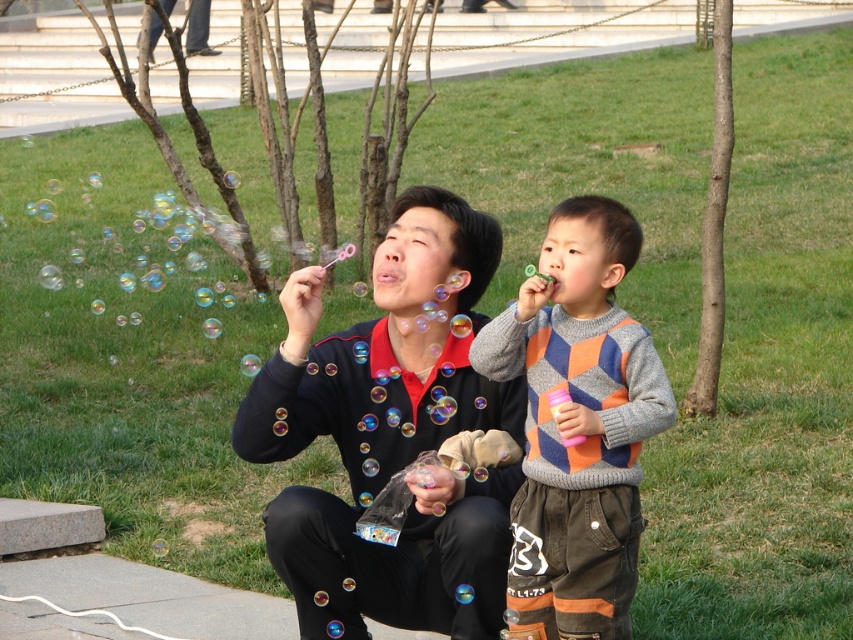
Between matte black sweater at center and green grass at lower center, which one appears on the right side from the viewer's perspective?

Positioned to the right is matte black sweater at center.

Which is in front, point (273, 364) or point (566, 0)?

Point (273, 364) is more forward.

Does point (372, 346) come farther from viewer compared to point (173, 100)?

That is False.

This screenshot has height=640, width=853. I want to click on matte black sweater at center, so click(392, 435).

Between knitted sweater at center and green grass at lower center, which one is positioned lower?

knitted sweater at center is below.

Between knitted sweater at center and green grass at lower center, which one has more height?

Standing taller between the two is green grass at lower center.

Locate an element on the screen. knitted sweater at center is located at coordinates (578, 426).

Who is lower down, matte black sweater at center or knitted sweater at center?

knitted sweater at center

Does matte black sweater at center have a smaller size compared to knitted sweater at center?

Incorrect, matte black sweater at center is not smaller in size than knitted sweater at center.

Between point (396, 250) and point (589, 348), which one is positioned behind?

The point (396, 250) is behind.

Find the location of `matte black sweater at center`. matte black sweater at center is located at coordinates (392, 435).